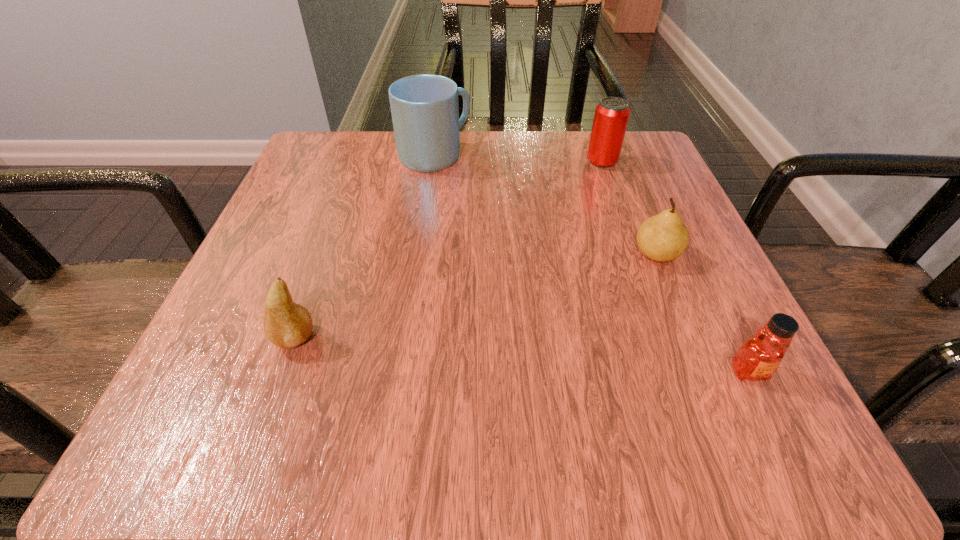
Where is `free space at the near edge of the desktop`? The width and height of the screenshot is (960, 540). free space at the near edge of the desktop is located at coordinates (555, 459).

The height and width of the screenshot is (540, 960). I want to click on vacant region at the left edge of the desktop, so click(x=349, y=201).

The height and width of the screenshot is (540, 960). In the image, there is a desktop. What are the coordinates of `vacant space at the right edge` in the screenshot? It's located at (721, 278).

The height and width of the screenshot is (540, 960). I want to click on vacant space at the far left corner of the desktop, so click(327, 181).

This screenshot has height=540, width=960. I want to click on vacant region at the near left corner of the desktop, so click(283, 394).

In the image, there is a desktop. Where is `free space at the far right corner`? Image resolution: width=960 pixels, height=540 pixels. free space at the far right corner is located at coordinates (588, 180).

Identify the location of free area in between the nearer pear and the nearest object. (521, 355).

The width and height of the screenshot is (960, 540). What are the coordinates of `vacant area that lies between the right pear and the nearest object` in the screenshot? It's located at (703, 313).

Locate an element on the screen. empty space between the fourth object from right to left and the nearest object is located at coordinates (591, 264).

At what (x,y) coordinates should I click in order to perform the action: click on free spot between the nearer pear and the nearest object. Please return your answer as a coordinate pair (x, y). The width and height of the screenshot is (960, 540). Looking at the image, I should click on (521, 355).